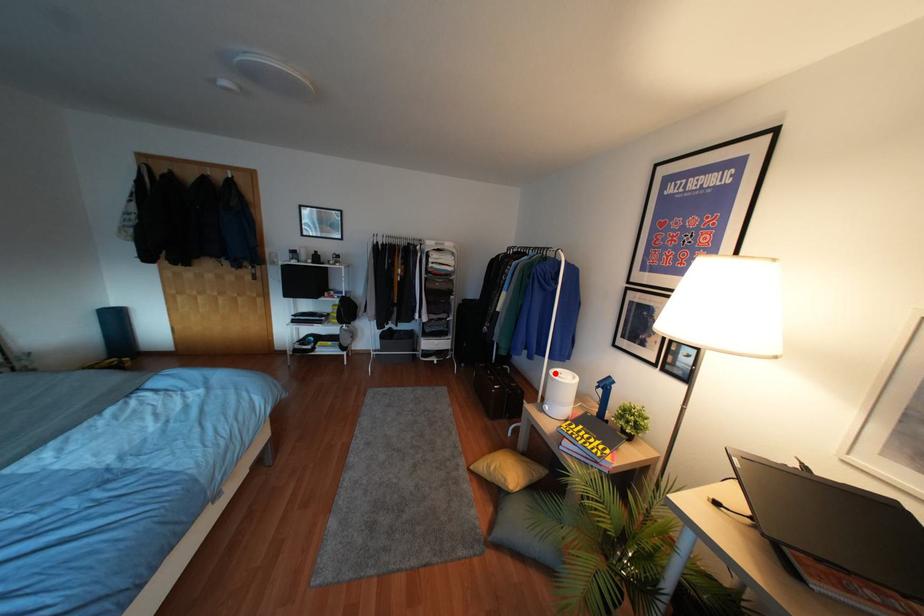
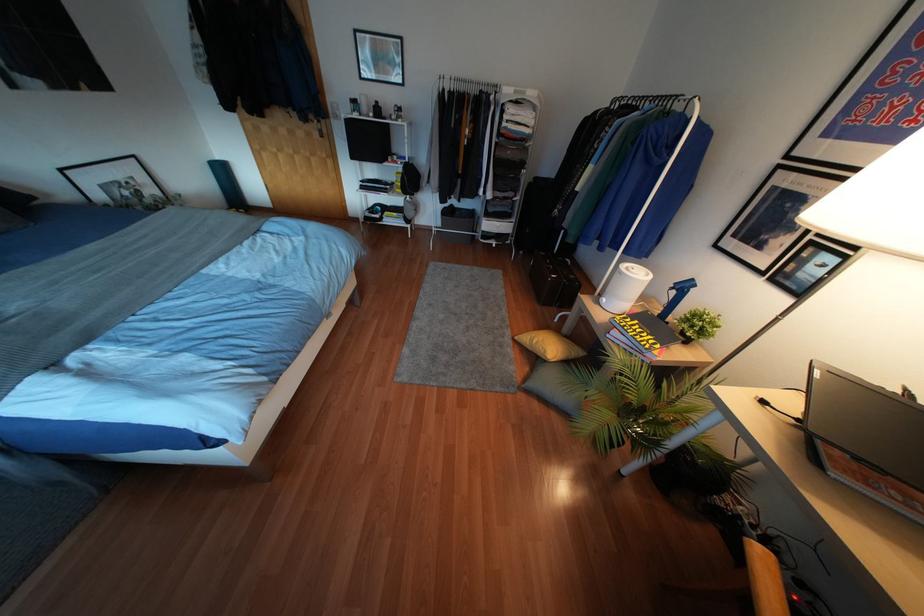
Find the pixel in the second image that matches the highlighted location in the first image.

(626, 268)